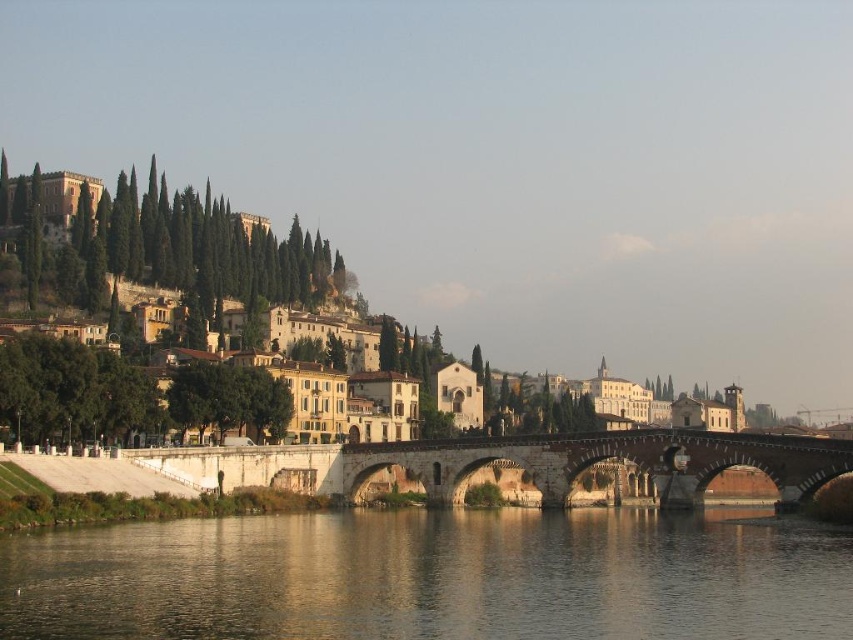
Question: Can you confirm if transparent water at center is positioned to the right of stone bridge at center?

Choices:
 (A) yes
 (B) no

Answer: (B)

Question: Which object appears farthest from the camera in this image?

Choices:
 (A) transparent water at center
 (B) yellow stone buildings at center

Answer: (B)

Question: Is transparent water at center to the left of yellow stone buildings at center from the viewer's perspective?

Choices:
 (A) no
 (B) yes

Answer: (A)

Question: Which point is farther from the camera taking this photo?

Choices:
 (A) (418, 612)
 (B) (312, 456)
 (C) (187, 248)

Answer: (C)

Question: Is transparent water at center thinner than stone bridge at center?

Choices:
 (A) no
 (B) yes

Answer: (B)

Question: Estimate the real-world distances between objects in this image. Which object is farther from the yellow stone buildings at center?

Choices:
 (A) transparent water at center
 (B) stone bridge at center

Answer: (B)